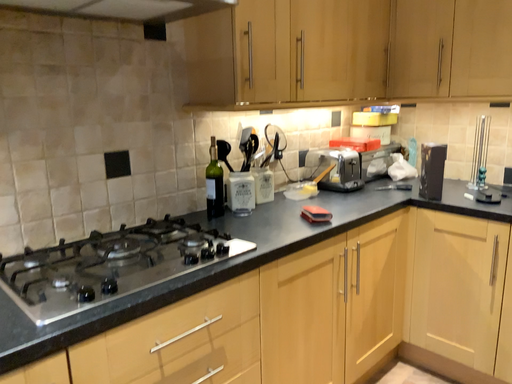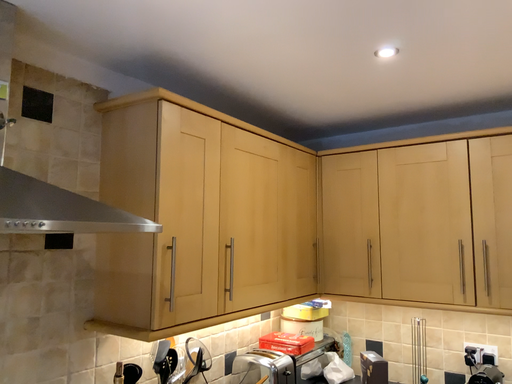
Question: How did the camera likely rotate when shooting the video?

Choices:
 (A) rotated upward
 (B) rotated downward

Answer: (A)